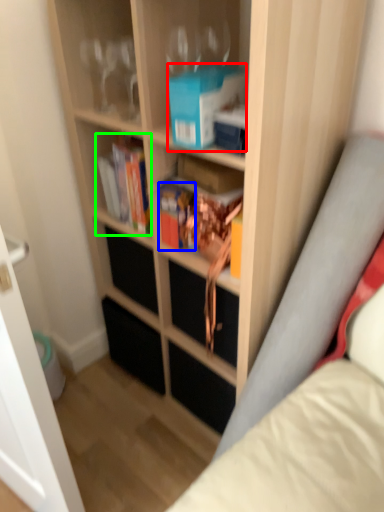
Question: Estimate the real-world distances between objects in this image. Which object is closer to paperback book (highlighted by a red box), book (highlighted by a blue box) or book (highlighted by a green box)?

Choices:
 (A) book
 (B) book

Answer: (A)